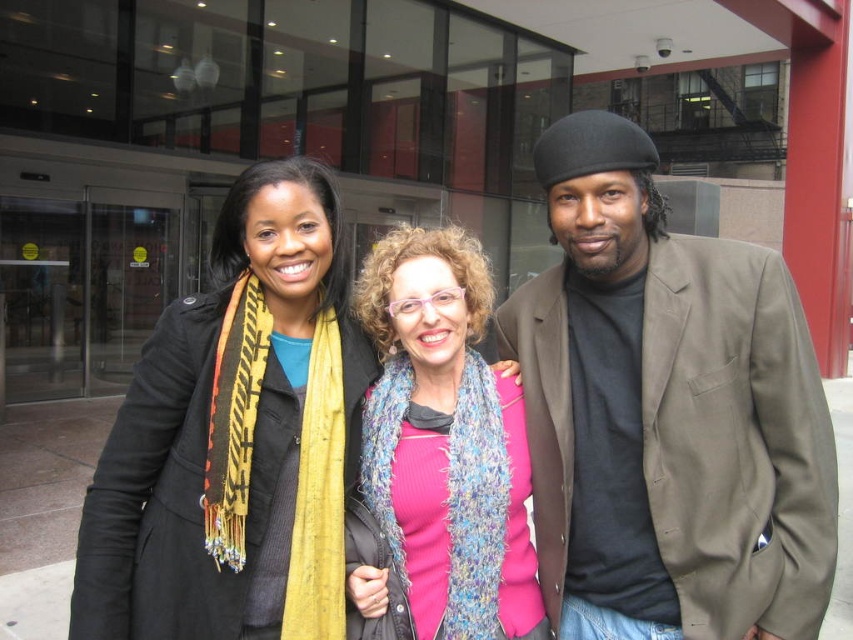
Question: Which object is the farthest from the matte black coat at center?

Choices:
 (A) matte brown blazer at center
 (B) pink knitted scarf at center

Answer: (A)

Question: Which object is positioned farthest from the pink knitted scarf at center?

Choices:
 (A) matte black coat at center
 (B) matte brown blazer at center

Answer: (B)

Question: Does matte brown blazer at center have a smaller size compared to matte black coat at center?

Choices:
 (A) yes
 (B) no

Answer: (B)

Question: In this image, where is matte brown blazer at center located relative to matte black coat at center?

Choices:
 (A) left
 (B) right

Answer: (B)

Question: Which point is closer to the camera?

Choices:
 (A) pink knitted scarf at center
 (B) matte brown blazer at center

Answer: (B)

Question: Does matte brown blazer at center appear on the left side of matte black coat at center?

Choices:
 (A) yes
 (B) no

Answer: (B)